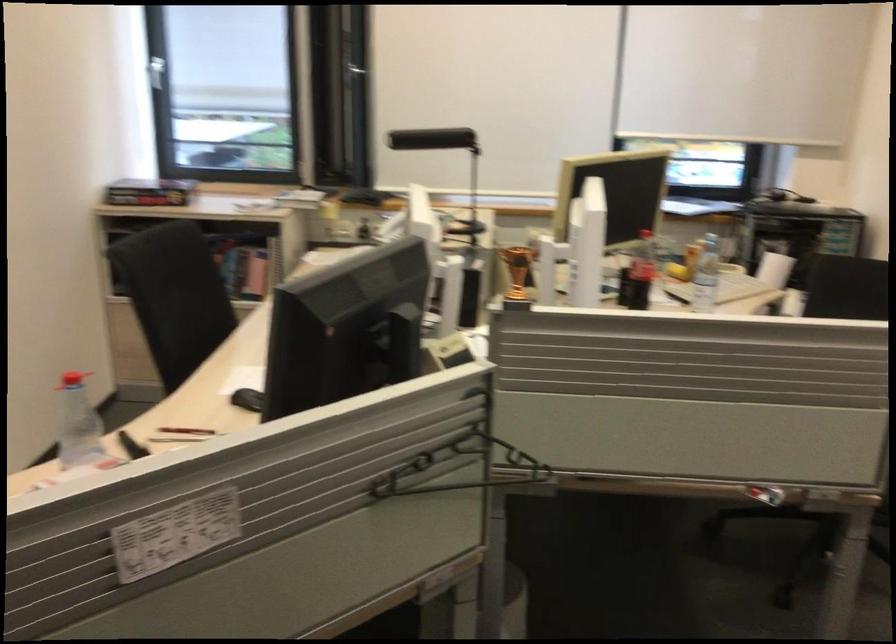
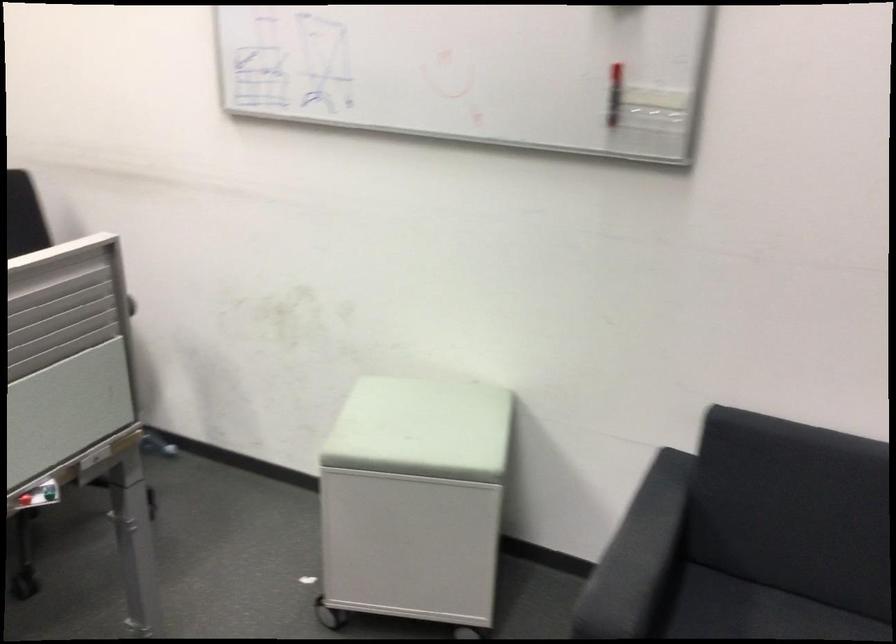
How did the camera likely rotate?

The camera's rotation is toward right-down.